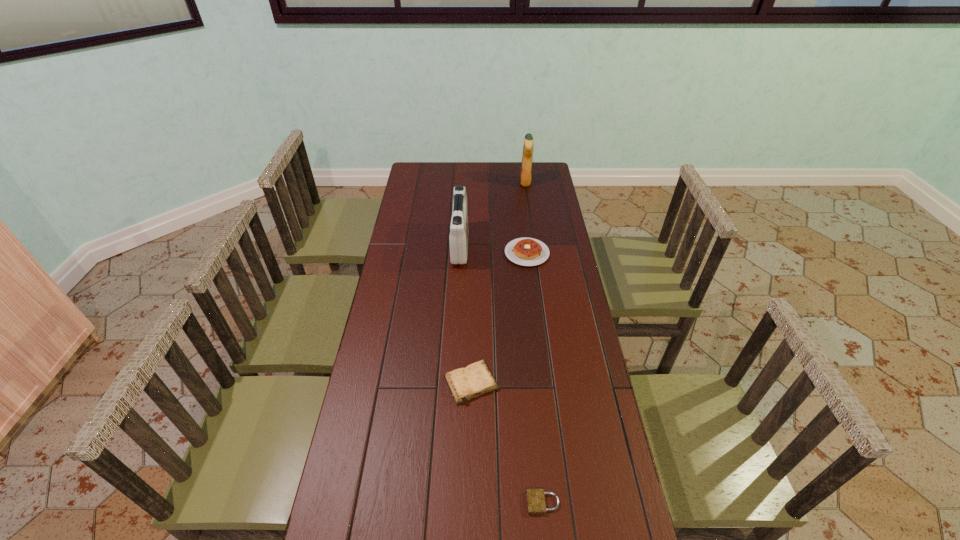
Identify the location of free point between the farthest object and the second nearest object. This screenshot has width=960, height=540. (498, 282).

I want to click on vacant area that lies between the first-aid kit and the second nearest object, so click(466, 314).

Identify the location of free space between the diary and the fourth shortest object. This screenshot has height=540, width=960. (466, 314).

Find the location of a particular element. Image resolution: width=960 pixels, height=540 pixels. free space that is in between the third shortest object and the fourth tallest object is located at coordinates (499, 318).

Where is `the third closest object relative to the detergent`? the third closest object relative to the detergent is located at coordinates (476, 379).

Find the location of a particular element. This screenshot has width=960, height=540. the third closest object relative to the first-aid kit is located at coordinates (x=476, y=379).

Where is `free space that satisfies the following two spatial constraints: 1. on the label of the farthest object; 2. on the front side of the fourth farthest object`? The height and width of the screenshot is (540, 960). free space that satisfies the following two spatial constraints: 1. on the label of the farthest object; 2. on the front side of the fourth farthest object is located at coordinates (554, 383).

The width and height of the screenshot is (960, 540). What are the coordinates of `free space that satisfies the following two spatial constraints: 1. on the back side of the pancake; 2. on the front side of the second tallest object` in the screenshot? It's located at (526, 246).

You are a GUI agent. You are given a task and a screenshot of the screen. Output one action in this format:
    pyautogui.click(x=<x>, y=<y>)
    Task: Click on the free space that satisfies the following two spatial constraints: 1. on the front side of the fourth tallest object; 2. on the right side of the first-aid kit
    
    Given the screenshot: What is the action you would take?
    pyautogui.click(x=452, y=383)

Where is `free location that satisfies the following two spatial constraints: 1. on the front side of the first-aid kit; 2. on the right side of the pancake`? free location that satisfies the following two spatial constraints: 1. on the front side of the first-aid kit; 2. on the right side of the pancake is located at coordinates (460, 253).